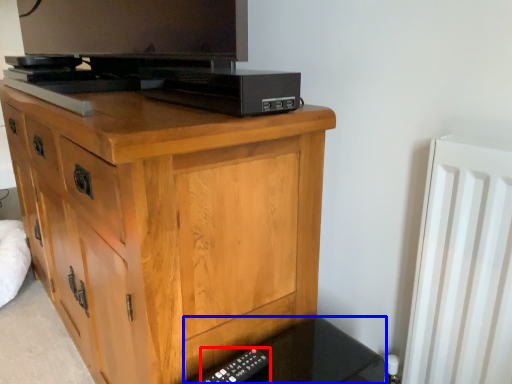
Question: Which object appears farthest to the camera in this image, remote (highlighted by a red box) or vanity (highlighted by a blue box)?

Choices:
 (A) remote
 (B) vanity

Answer: (A)